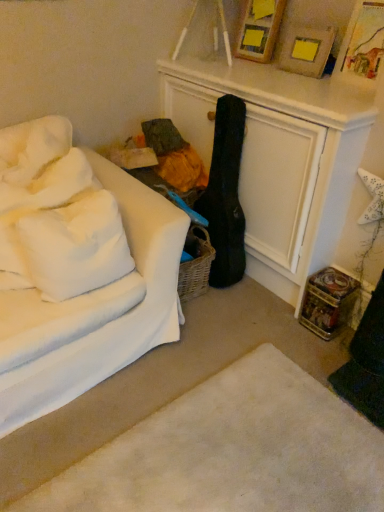
Question: Could you tell me if white soft rug at lower center is turned towards white soft pillow at left, which is the second pillow from top to bottom?

Choices:
 (A) no
 (B) yes

Answer: (A)

Question: Considering the relative sizes of white soft rug at lower center and white soft pillow at left, which is the second pillow from top to bottom, in the image provided, is white soft rug at lower center shorter than white soft pillow at left, which is the second pillow from top to bottom,?

Choices:
 (A) yes
 (B) no

Answer: (A)

Question: Is white soft rug at lower center outside of white soft pillow at left, which is the second pillow from top to bottom?

Choices:
 (A) yes
 (B) no

Answer: (A)

Question: Does white soft rug at lower center appear on the right side of white soft pillow at left, which is the second pillow from top to bottom?

Choices:
 (A) no
 (B) yes

Answer: (B)

Question: Is white soft rug at lower center in front of white soft pillow at left, which is the second pillow from top to bottom?

Choices:
 (A) no
 (B) yes

Answer: (B)

Question: From the image's perspective, is white soft rug at lower center on top of white soft pillow at left, the 1th pillow positioned from the bottom?

Choices:
 (A) yes
 (B) no

Answer: (B)

Question: From the image's perspective, does white soft pillow at left, which is the second pillow from top to bottom, appear lower than white fabric couch at left?

Choices:
 (A) no
 (B) yes

Answer: (A)

Question: Is white soft pillow at left, the 1th pillow positioned from the bottom, far from white fabric couch at left?

Choices:
 (A) no
 (B) yes

Answer: (A)

Question: Is white soft pillow at left, which is the second pillow from top to bottom, to the left of white fabric couch at left from the viewer's perspective?

Choices:
 (A) yes
 (B) no

Answer: (B)

Question: Is white soft pillow at left, the 1th pillow positioned from the bottom, oriented towards white fabric couch at left?

Choices:
 (A) yes
 (B) no

Answer: (A)

Question: Considering the relative sizes of white soft pillow at left, which is the second pillow from top to bottom, and white fabric couch at left in the image provided, is white soft pillow at left, which is the second pillow from top to bottom, thinner than white fabric couch at left?

Choices:
 (A) no
 (B) yes

Answer: (B)

Question: Does white soft pillow at left, the 1th pillow positioned from the bottom, appear on the right side of white fabric couch at left?

Choices:
 (A) yes
 (B) no

Answer: (A)

Question: Can white fabric couch at left be found inside wooden picture frame at upper center, which ranks as the second picture frame in front-to-back order?

Choices:
 (A) yes
 (B) no

Answer: (B)